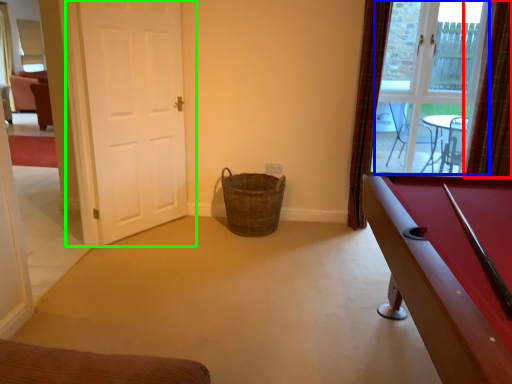
Question: Estimate the real-world distances between objects in this image. Which object is closer to curtain (highlighted by a red box), window screen (highlighted by a blue box) or door (highlighted by a green box)?

Choices:
 (A) window screen
 (B) door

Answer: (A)